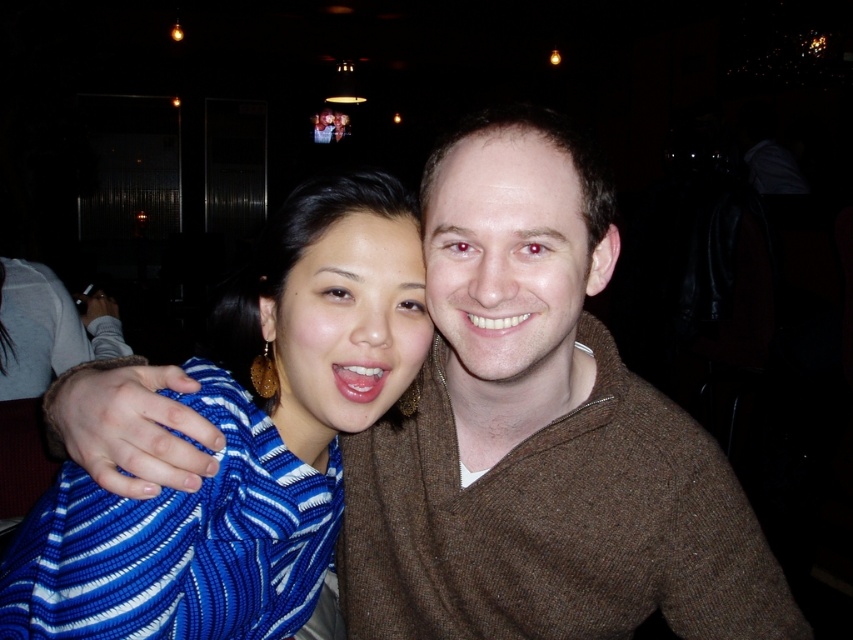
Question: Is brown wool sweater at center above blue knitted sweater at center?

Choices:
 (A) no
 (B) yes

Answer: (A)

Question: Is brown wool sweater at center above blue knitted sweater at center?

Choices:
 (A) no
 (B) yes

Answer: (A)

Question: Is brown wool sweater at center smaller than blue knitted sweater at center?

Choices:
 (A) no
 (B) yes

Answer: (A)

Question: Among these objects, which one is nearest to the camera?

Choices:
 (A) blue knitted sweater at center
 (B) brown wool sweater at center

Answer: (A)

Question: Which point is closer to the camera?

Choices:
 (A) (444, 280)
 (B) (193, 513)

Answer: (B)

Question: Which point appears farthest from the camera in this image?

Choices:
 (A) (552, 220)
 (B) (335, 182)

Answer: (B)